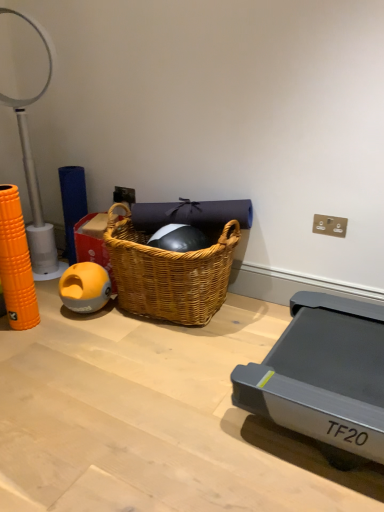
Question: Is yellow rubber ball at left taller or shorter than woven wood picnic basket at center?

Choices:
 (A) tall
 (B) short

Answer: (B)

Question: Relative to woven wood picnic basket at center, is yellow rubber ball at left in front or behind?

Choices:
 (A) behind
 (B) front

Answer: (A)

Question: Estimate the real-world distances between objects in this image. Which object is farther from the white plastic table lamp at left?

Choices:
 (A) wooden floor at lower left
 (B) yellow rubber ball at left
 (C) woven wood picnic basket at center

Answer: (A)

Question: Which object is the closest to the yellow rubber ball at left?

Choices:
 (A) white plastic table lamp at left
 (B) woven wood picnic basket at center
 (C) wooden floor at lower left

Answer: (B)